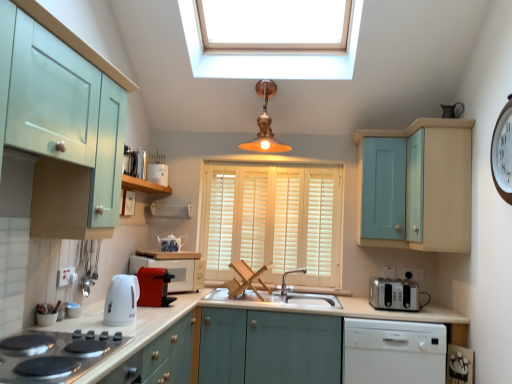
The image size is (512, 384). I want to click on free space behind white glossy electric kettle at lower left, so click(x=142, y=315).